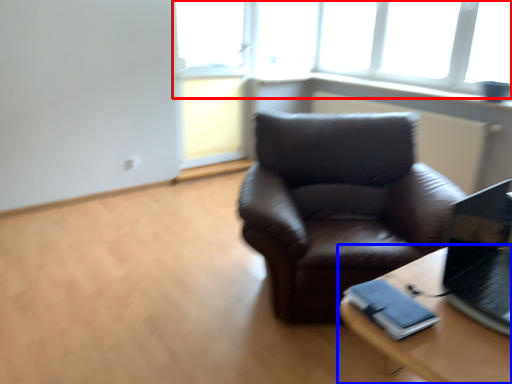
Question: Which point is closer to the camera, window (highlighted by a red box) or table (highlighted by a blue box)?

Choices:
 (A) window
 (B) table

Answer: (B)